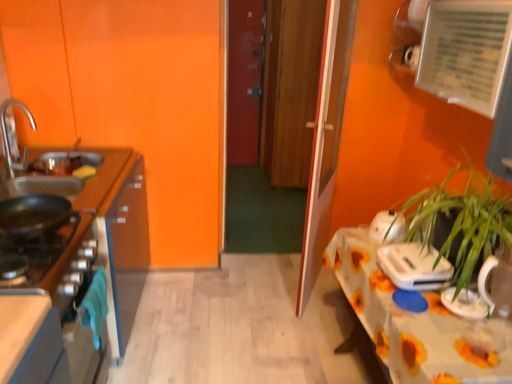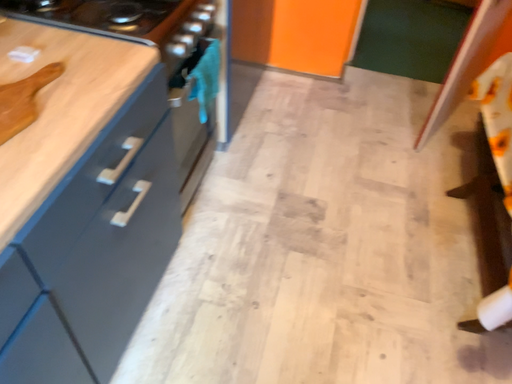
Question: Which way did the camera rotate in the video?

Choices:
 (A) rotated right
 (B) rotated left

Answer: (B)